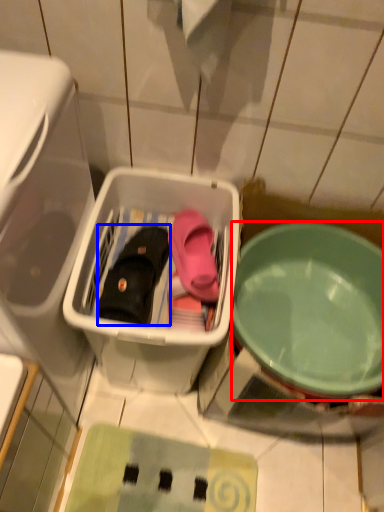
Question: Among these objects, which one is nearest to the camera, bowl (highlighted by a red box) or footwear (highlighted by a blue box)?

Choices:
 (A) bowl
 (B) footwear

Answer: (A)